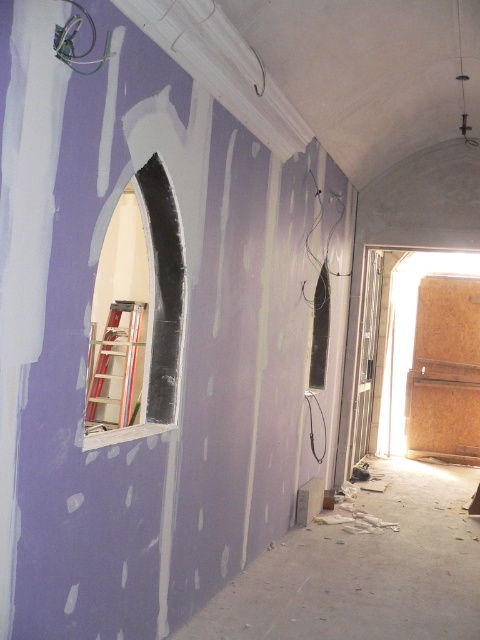
Question: Is smooth white archway at center positioned at the back of metallic silver ladder at left?

Choices:
 (A) yes
 (B) no

Answer: (B)

Question: Which object is closer to the camera taking this photo?

Choices:
 (A) smooth white archway at center
 (B) metallic silver ladder at left

Answer: (A)

Question: Which of the following is the closest to the observer?

Choices:
 (A) (120, 328)
 (B) (157, 237)

Answer: (B)

Question: In this image, where is smooth white archway at center located relative to metallic silver ladder at left?

Choices:
 (A) left
 (B) right

Answer: (B)

Question: Does smooth white archway at center appear on the left side of metallic silver ladder at left?

Choices:
 (A) yes
 (B) no

Answer: (B)